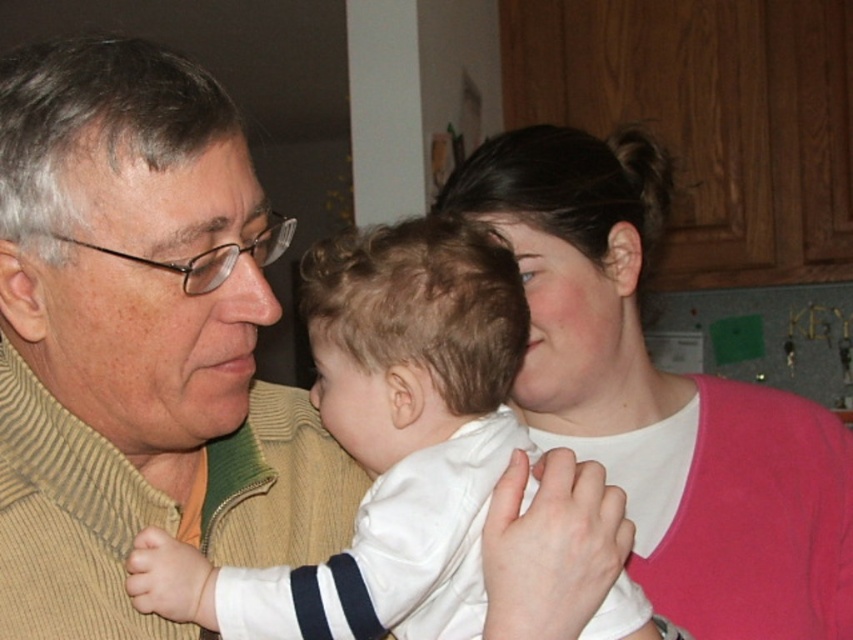
You are standing at the origin point in the image. Which of the two points, point (773, 637) or point (503, 288), is farther away from you?

Point (773, 637) is farther away from you because it is behind point (503, 288).

You are a photographer trying to capture a closeup shot of the pink matte sweater at upper right and the white satin baby at center. Given that your camera lens has a minimum focusing distance of 30 centimeters, will you be able to take the photo without moving the camera closer?

The pink matte sweater at upper right and the white satin baby at center are 28.46 centimeters apart from each other. Since the minimum focusing distance is 30 centimeters, the camera cannot focus properly at this distance. You need to move the camera closer to ensure both subjects are in focus.